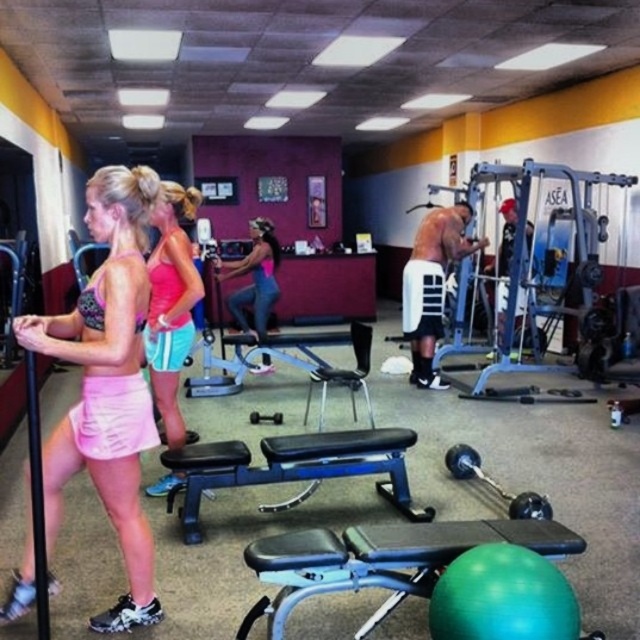
In the scene shown: You are a fitness trainer observing the gym scene. You need to recommend an exercise that requires using the larger object between the pink fabric shorts at center and the black rubber dumbbell at center. Which object should you choose?

The pink fabric shorts at center is bigger than the black rubber dumbbell at center, so you should choose the pink fabric shorts at center for the exercise.

You are a gym trainer observing two women in the gym. The first woman is wearing a pink sports bra and matching shorts, holding a black resistance band. The second woman is in a pink tank top and light blue shorts, stretching. The pink fabric shorts at center belong to which woman? Please explain your reasoning.

The pink fabric shorts at center belong to the first woman wearing the pink sports bra and matching shorts, as the description specifies that the second woman is wearing light blue shorts.